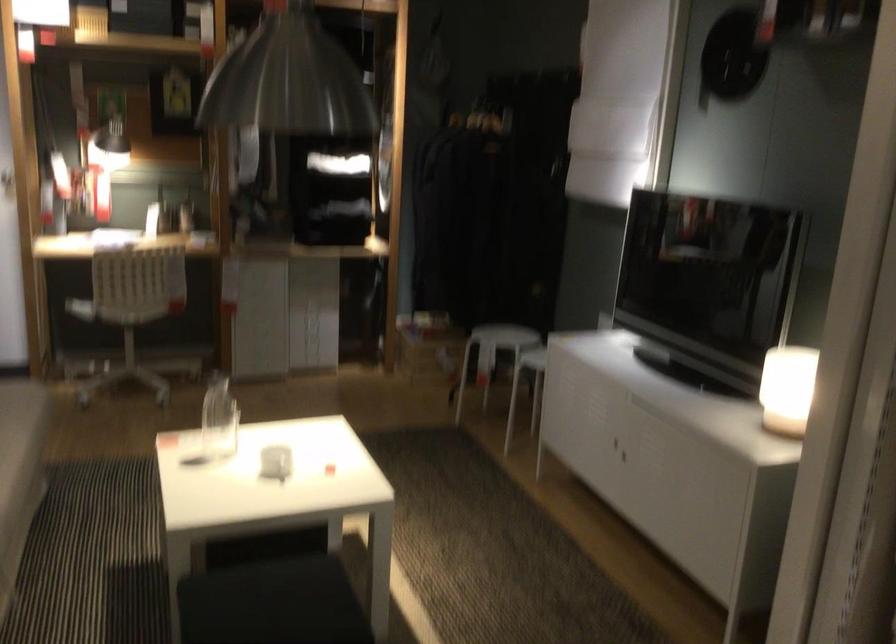
Where is `glowing table lamp`? This screenshot has height=644, width=896. glowing table lamp is located at coordinates (788, 380).